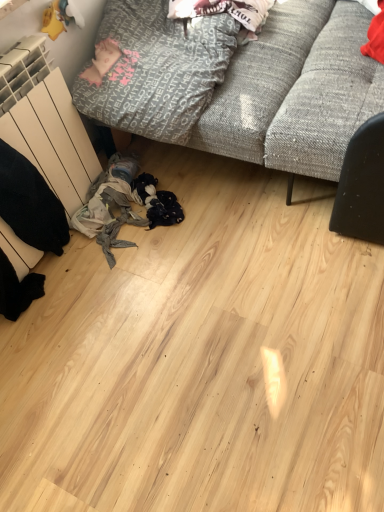
Question: From the image's perspective, is textured gray couch at upper center located above or below white cotton t-shirt at upper center, the first clothing positioned from the top?

Choices:
 (A) below
 (B) above

Answer: (A)

Question: Relative to white cotton t-shirt at upper center, which appears as the second clothing when ordered from the bottom, is textured gray couch at upper center in front or behind?

Choices:
 (A) front
 (B) behind

Answer: (A)

Question: Which object is the farthest from the white cotton t-shirt at upper center, the first clothing positioned from the top?

Choices:
 (A) textured gray couch at upper center
 (B) textured gray blanket at upper left, which appears as the 2th clothing when viewed from the top

Answer: (A)

Question: Which of these objects is positioned closest to the textured gray blanket at upper left, which appears as the first clothing when ordered from the bottom?

Choices:
 (A) white cotton t-shirt at upper center, the first clothing positioned from the top
 (B) textured gray couch at upper center

Answer: (B)